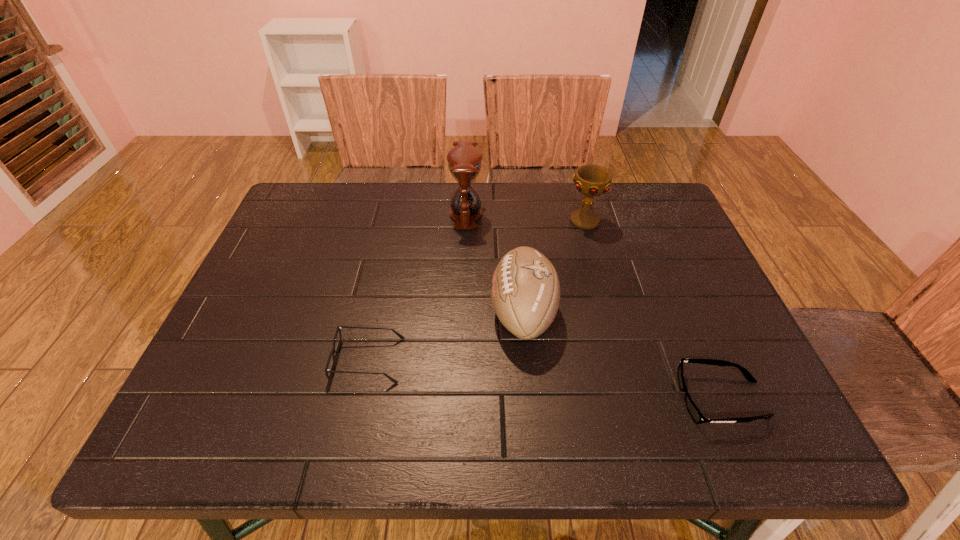
Identify the location of hourglass. The height and width of the screenshot is (540, 960). (464, 160).

Find the location of a particular element. The height and width of the screenshot is (540, 960). the second object from left to right is located at coordinates click(464, 160).

Locate an element on the screen. Image resolution: width=960 pixels, height=540 pixels. the fourth object from left to right is located at coordinates (591, 180).

Where is `football (American)`? The image size is (960, 540). football (American) is located at coordinates (525, 290).

Find the location of `the leftmost object`. the leftmost object is located at coordinates (332, 353).

This screenshot has width=960, height=540. I want to click on sunglasses, so click(x=697, y=416).

Find the location of a particular element. The image size is (960, 540). vacant space located on the right of the hourglass is located at coordinates (523, 213).

The height and width of the screenshot is (540, 960). What are the coordinates of `free space located 0.100m on the front of the second object from right to left` in the screenshot? It's located at (594, 256).

Identify the location of vacant space located 0.100m on the laces of the third object from left to right. (446, 313).

Locate an element on the screen. The height and width of the screenshot is (540, 960). free space located on the laces of the third object from left to right is located at coordinates (325, 313).